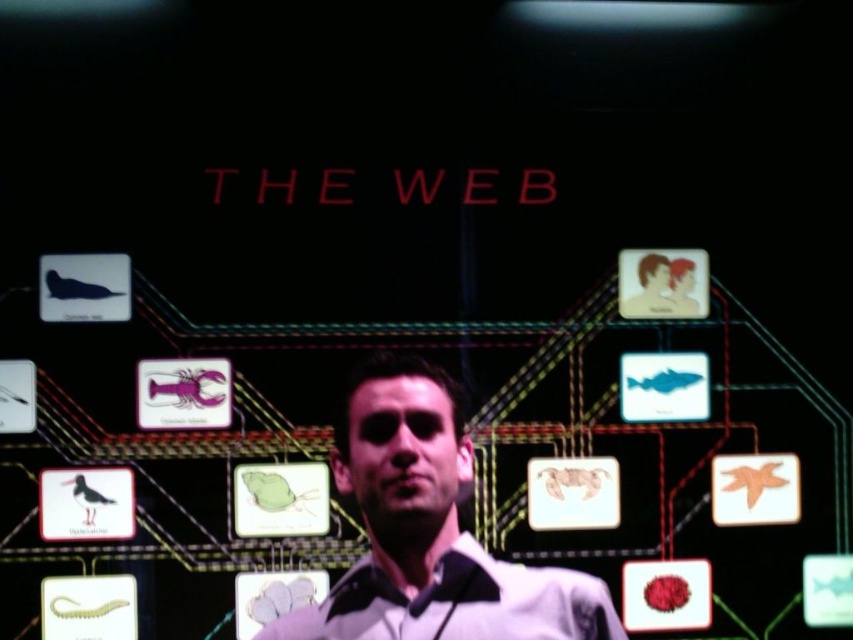
Who is shorter, white matte shirt at center or white glossy dress shirt at center?

white glossy dress shirt at center

Which of these two, white matte shirt at center or white glossy dress shirt at center, stands taller?

white matte shirt at center is taller.

Is point (383, 451) more distant than point (317, 618)?

No, it is in front of (317, 618).

Where is `white matte shirt at center`? The height and width of the screenshot is (640, 853). white matte shirt at center is located at coordinates (428, 531).